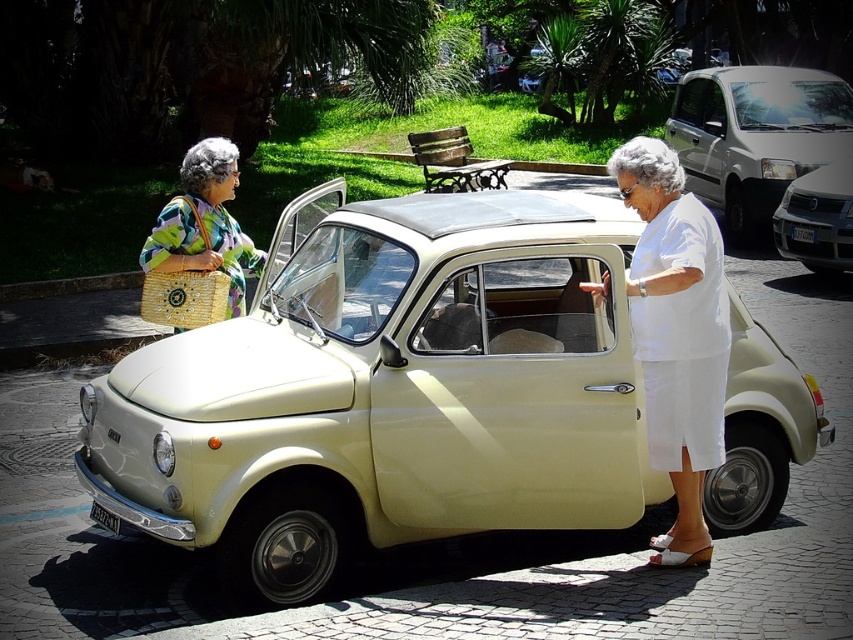
Question: Which point is closer to the camera?

Choices:
 (A) matte cream car at center
 (B) white matte van at center
 (C) white cotton dress at center
 (D) multicolored woven bag at upper left

Answer: (A)

Question: Can you confirm if matte cream car at center is positioned to the right of white cotton dress at center?

Choices:
 (A) no
 (B) yes

Answer: (A)

Question: Can you confirm if white matte van at center is positioned below multicolored woven bag at upper left?

Choices:
 (A) yes
 (B) no

Answer: (B)

Question: Estimate the real-world distances between objects in this image. Which object is farther from the metallic silver car at center?

Choices:
 (A) white cotton dress at center
 (B) matte cream car at center
 (C) white matte van at center

Answer: (B)

Question: Considering the relative positions of matte cream car at center and white matte van at center in the image provided, where is matte cream car at center located with respect to white matte van at center?

Choices:
 (A) below
 (B) above

Answer: (A)

Question: Which point is closer to the camera taking this photo?

Choices:
 (A) (805, 227)
 (B) (727, 381)
 (C) (683, 499)
 (D) (204, 230)

Answer: (C)